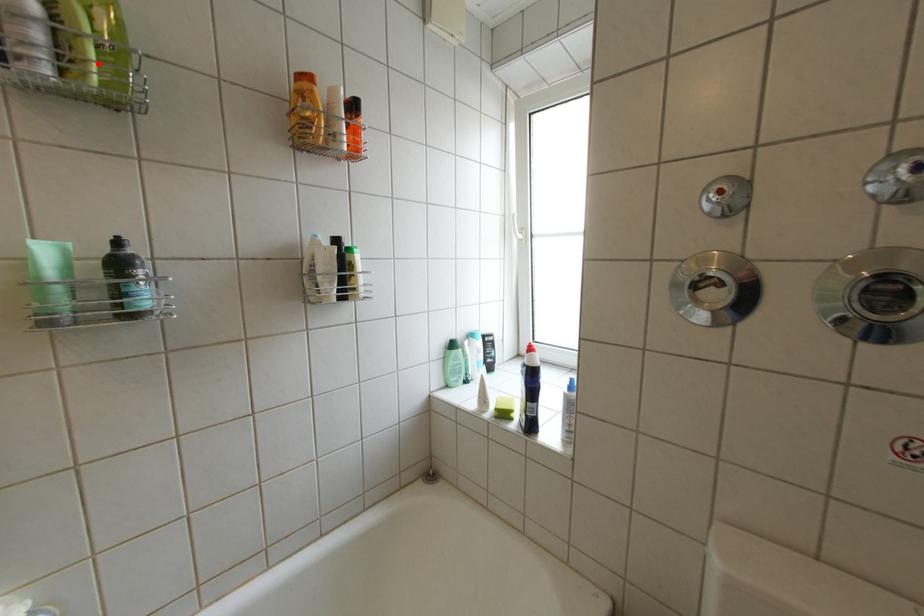
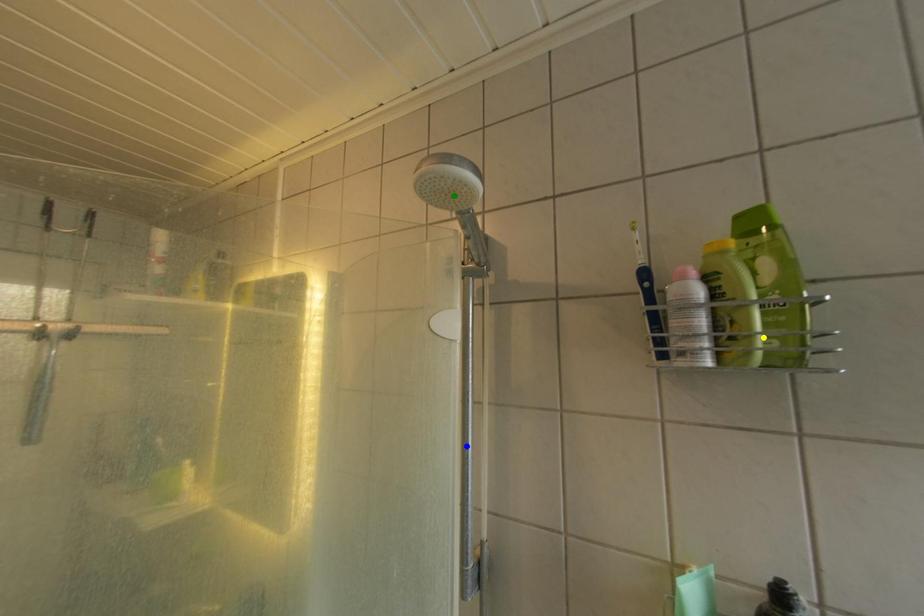
Question: I am providing you with two images of the same scene from different viewpoints. A red point is marked on the first image. You are given multiple points on the second image. In image 2, which mark is for the same physical point as the one in image 1?

Choices:
 (A) blue point
 (B) yellow point
 (C) green point

Answer: (B)